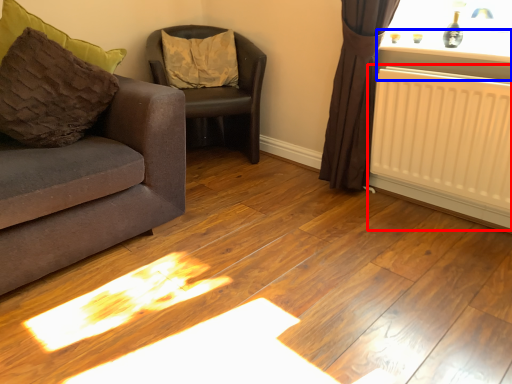
Question: Which object appears farthest to the camera in this image, radiator (highlighted by a red box) or window sill (highlighted by a blue box)?

Choices:
 (A) radiator
 (B) window sill

Answer: (B)